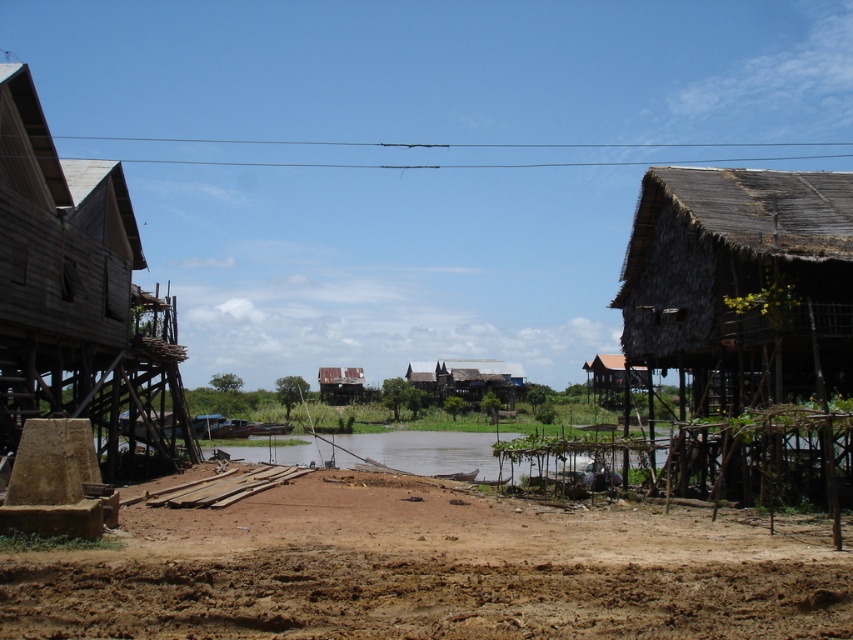
Question: Which of the following is the farthest from the observer?

Choices:
 (A) (468, 396)
 (B) (67, 308)
 (C) (659, 237)
 (D) (323, 368)

Answer: (D)

Question: Estimate the real-world distances between objects in this image. Which object is farther from the brown sandy dirt field at lower center?

Choices:
 (A) thatched wood hut at right
 (B) rusty corrugated metal hut at center
 (C) rustic wooden houses at center

Answer: (B)

Question: Is wooden hut at left further to camera compared to rusty corrugated metal hut at center?

Choices:
 (A) yes
 (B) no

Answer: (B)

Question: Does thatched wood hut at right appear under wooden hut at left?

Choices:
 (A) yes
 (B) no

Answer: (B)

Question: Among these points, which one is nearest to the camera?

Choices:
 (A) (90, 307)
 (B) (741, 396)
 (C) (508, 596)

Answer: (C)

Question: Does wooden hut at left appear under rusty corrugated metal hut at center?

Choices:
 (A) no
 (B) yes

Answer: (A)